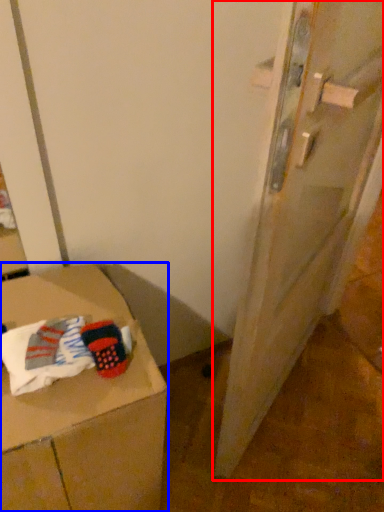
Question: Which object is closer to the camera taking this photo, door (highlighted by a red box) or furniture (highlighted by a blue box)?

Choices:
 (A) door
 (B) furniture

Answer: (A)